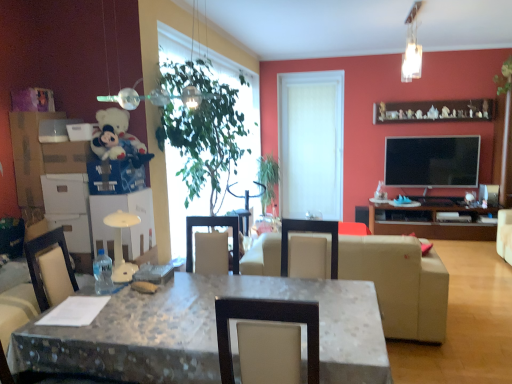
Question: Would you say green leafy plant at upper right, the 2th plant viewed from the left, is inside or outside green leafy plant at center, marked as the 1th plant in a left-to-right arrangement?

Choices:
 (A) inside
 (B) outside

Answer: (B)

Question: From a real-world perspective, is green leafy plant at upper right, which is counted as the 1th plant, starting from the top, physically located above or below green leafy plant at center, marked as the 1th plant in a left-to-right arrangement?

Choices:
 (A) above
 (B) below

Answer: (A)

Question: Which object is the closest to the wooden figurines at upper right?

Choices:
 (A) translucent glass pendant light at upper right, which is counted as the first lamp, starting from the right
 (B) metallic blue box at upper left, positioned as the first box in right-to-left order
 (C) metallic glass pendant light at upper center, arranged as the 2th lamp when viewed from the top
 (D) white matte door at center
 (E) green leafy plant at center, which is the 2th plant from right to left

Answer: (D)

Question: Which of these objects is positioned closest to the green leafy plant at upper right, the second plant in the bottom-to-top sequence?

Choices:
 (A) green leafy plant at center
 (B) white matte door at center
 (C) fluffy white teddy bear at upper left
 (D) metallic glass pendant light at upper center, which is the second lamp from right to left
 (E) translucent glass pendant light at upper right, which appears as the second lamp when ordered from the bottom

Answer: (E)